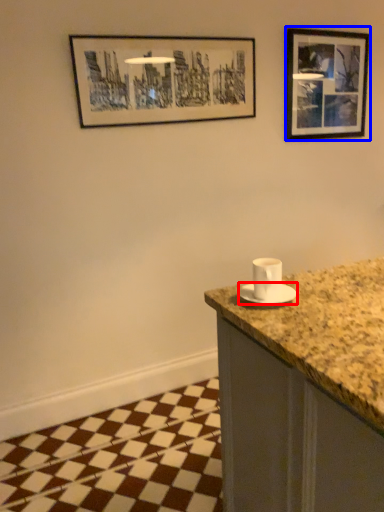
Question: Which object appears farthest to the camera in this image, saucer (highlighted by a red box) or picture frame (highlighted by a blue box)?

Choices:
 (A) saucer
 (B) picture frame

Answer: (B)